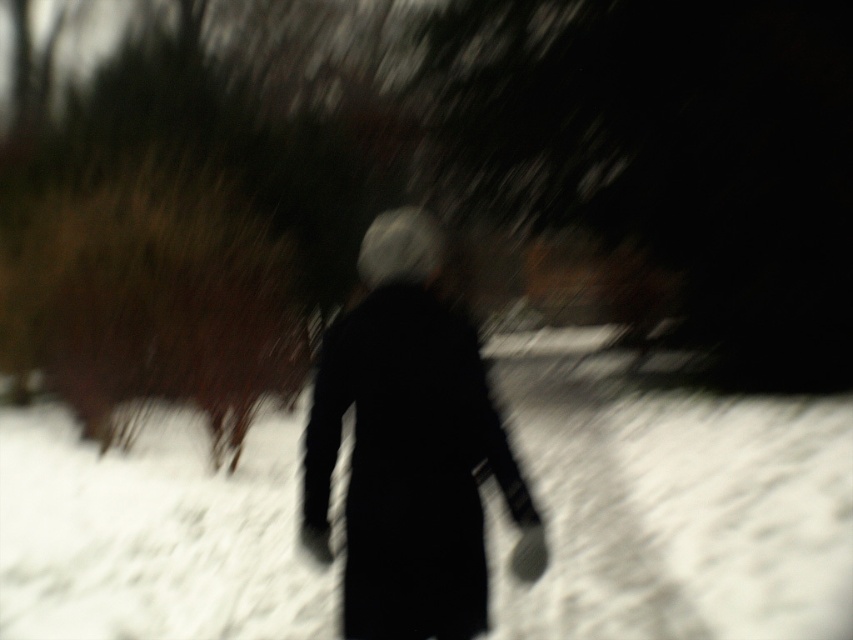
You are standing in the snowy environment and see two points marked in the image. Which point is closer to you, point (804, 582) or point (428, 458)?

Point (804, 582) is further to the viewer than point (428, 458), so point (428, 458) is closer to you.

You are a photographer trying to capture the contrast between the white fluffy snow at center and the black matte coat at center. Which object is located to the right of the other?

The white fluffy snow at center is positioned on the right side of black matte coat at center.